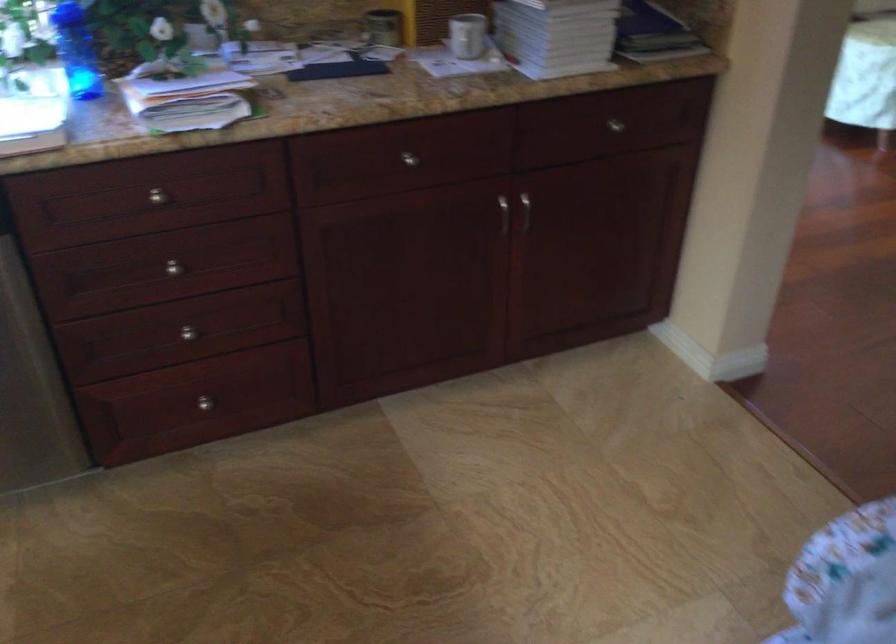
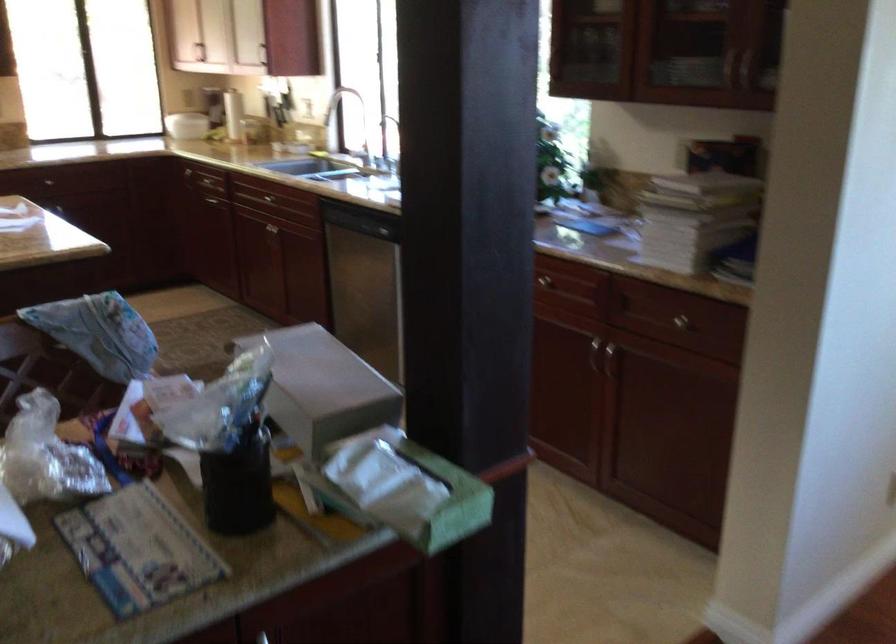
Question: I am providing you with two images of the same scene from different viewpoints. Which of the following objects are not visible in image2?

Choices:
 (A) red snack bag
 (B) silver drawer knob
 (C) grey cardboard box
 (D) faucet handle

Answer: (B)